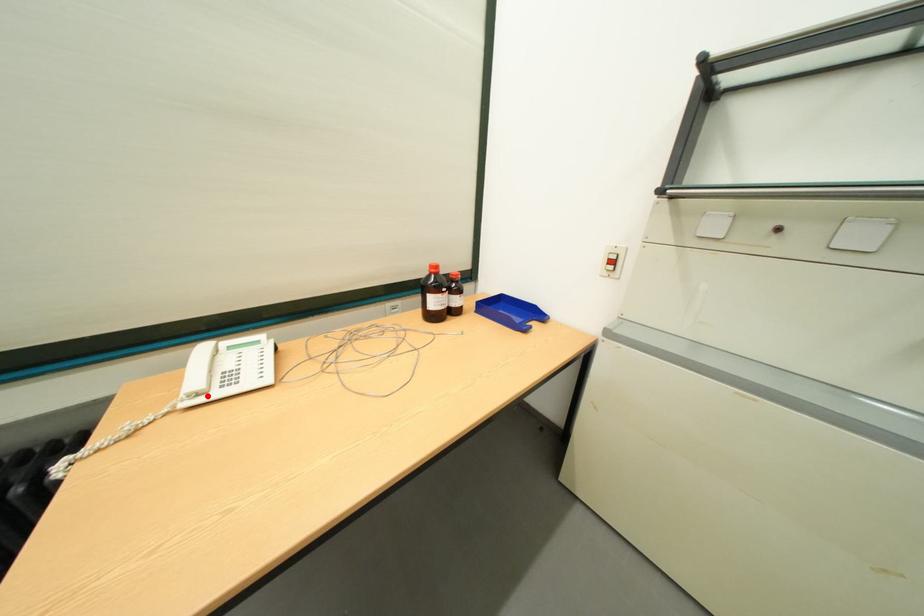
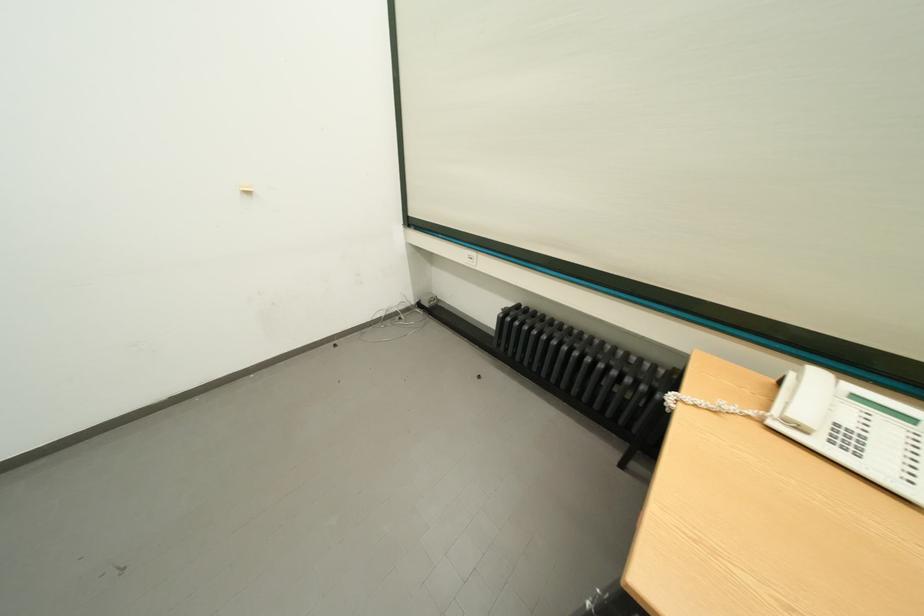
In the second image, find the point that corresponds to the highlighted location in the first image.

(809, 430)